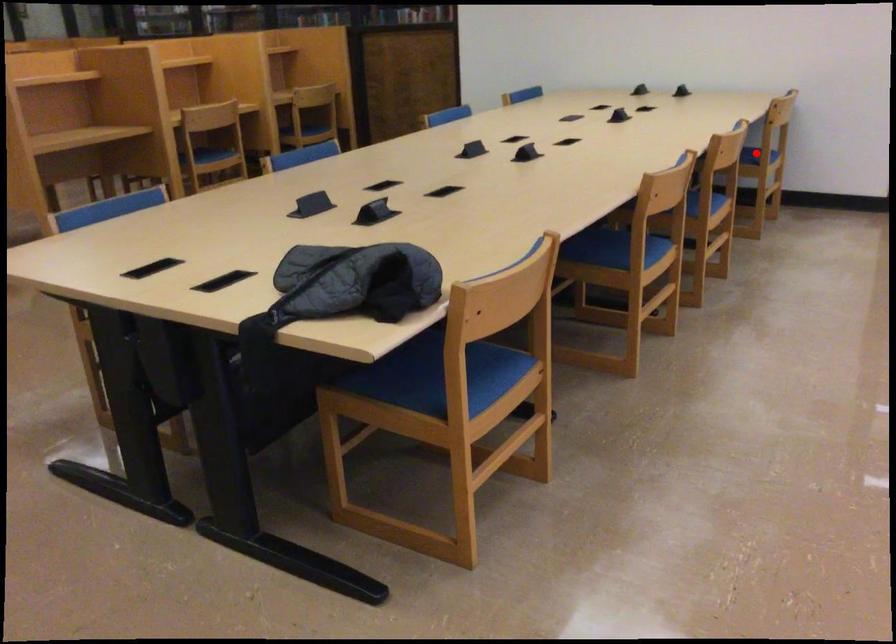
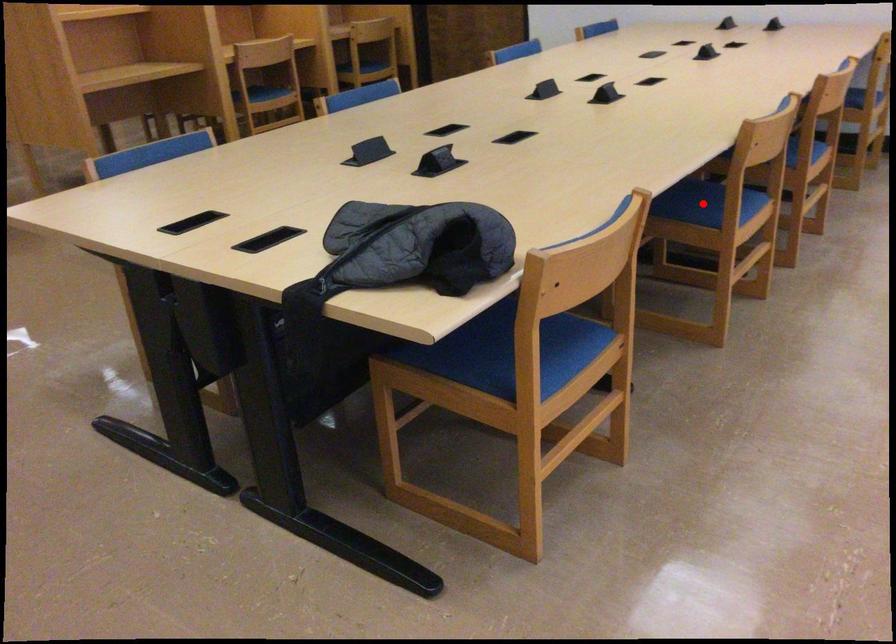
I am providing you with two images of the same scene from different viewpoints. A red point is marked on the first image and another point is marked on the second image. Do the highlighted points in image1 and image2 indicate the same real-world spot?

No